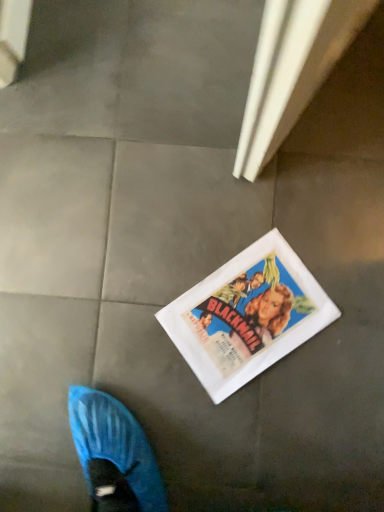
Locate an element on the screen. The image size is (384, 512). white paper movie poster at center is located at coordinates (247, 315).

What do you see at coordinates (247, 315) in the screenshot?
I see `white paper movie poster at center` at bounding box center [247, 315].

Measure the distance between point (238,283) and camera.

They are 32.99 inches apart.

The image size is (384, 512). I want to click on white paper movie poster at center, so click(247, 315).